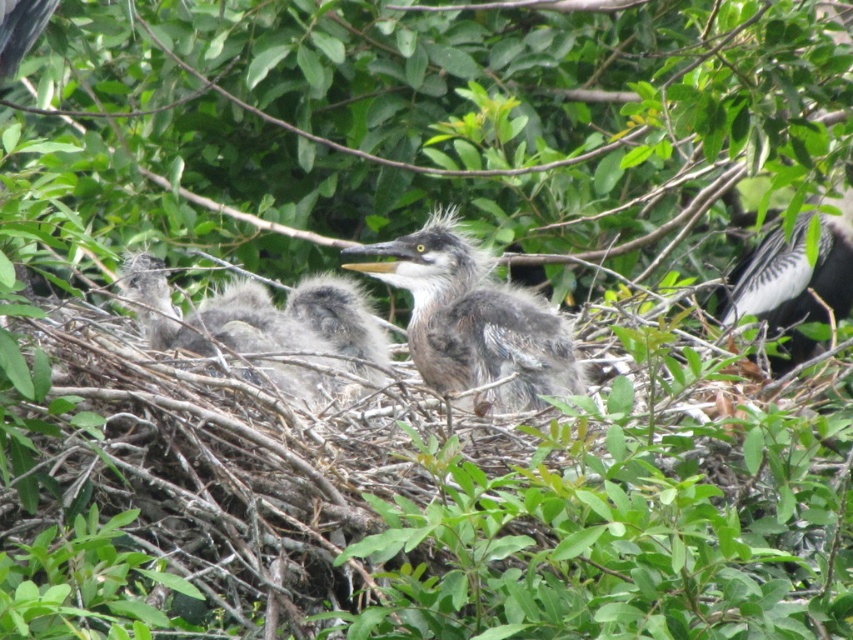
You are a photographer aiming to capture a detailed image of the birds in the nest. You notice two points of interest marked as point (440, 305) and point (196, 346). Which point should you focus on to ensure the birds are in sharp focus?

You should focus on point (440, 305) because it is closer to the camera than point (196, 346), ensuring the birds in that area will be in sharp focus.

Looking at this image, you are a wildlife photographer aiming to capture a clear shot of the gray fluffy bird at center. Based on its position, where should you focus your camera to ensure the bird is centered in the frame?

The gray fluffy bird at center is located at the 2D coordinates point (474, 321), so you should focus your camera at that point to center the bird in the frame.